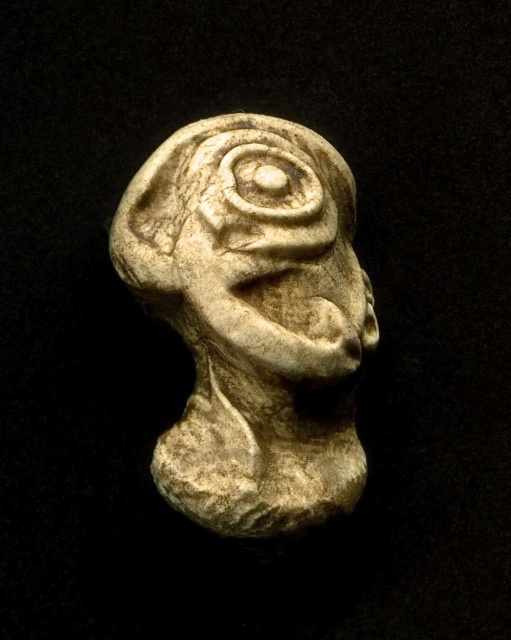
Question: Is white stone head at center to the left of white stone face at center from the viewer's perspective?

Choices:
 (A) no
 (B) yes

Answer: (B)

Question: Which of the following is the closest to the observer?

Choices:
 (A) (290, 147)
 (B) (332, 285)

Answer: (B)

Question: Can you confirm if white stone head at center is bigger than white stone face at center?

Choices:
 (A) no
 (B) yes

Answer: (B)

Question: Observing the image, what is the correct spatial positioning of white stone head at center in reference to white stone face at center?

Choices:
 (A) right
 (B) left

Answer: (B)

Question: Which point appears farthest from the camera in this image?

Choices:
 (A) (229, 220)
 (B) (138, 248)

Answer: (B)

Question: Which point is closer to the camera?

Choices:
 (A) (282, 307)
 (B) (198, 211)

Answer: (A)